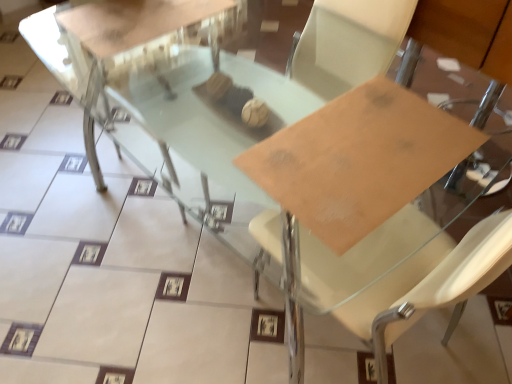
Question: Is matte cardboard at center at the back of clear glass table at center?

Choices:
 (A) no
 (B) yes

Answer: (A)

Question: Considering the relative sizes of clear glass table at center and matte cardboard at center in the image provided, is clear glass table at center bigger than matte cardboard at center?

Choices:
 (A) no
 (B) yes

Answer: (B)

Question: Is clear glass table at center further to camera compared to matte cardboard at center?

Choices:
 (A) no
 (B) yes

Answer: (B)

Question: Is clear glass table at center not near matte cardboard at center?

Choices:
 (A) yes
 (B) no

Answer: (A)

Question: Is clear glass table at center thinner than matte cardboard at center?

Choices:
 (A) no
 (B) yes

Answer: (A)

Question: From a real-world perspective, is clear glass table at center under matte cardboard at center?

Choices:
 (A) no
 (B) yes

Answer: (B)

Question: Is matte cardboard at center further to camera compared to clear glass table at center?

Choices:
 (A) no
 (B) yes

Answer: (A)

Question: Can you confirm if matte cardboard at center is thinner than clear glass table at center?

Choices:
 (A) no
 (B) yes

Answer: (B)

Question: Is matte cardboard at center taller than clear glass table at center?

Choices:
 (A) yes
 (B) no

Answer: (B)

Question: Can you confirm if matte cardboard at center is smaller than clear glass table at center?

Choices:
 (A) yes
 (B) no

Answer: (A)

Question: From the image's perspective, would you say matte cardboard at center is positioned over clear glass table at center?

Choices:
 (A) yes
 (B) no

Answer: (B)

Question: From a real-world perspective, is matte cardboard at center physically below clear glass table at center?

Choices:
 (A) yes
 (B) no

Answer: (B)

Question: Is matte cardboard at center in front of or behind clear glass table at center in the image?

Choices:
 (A) front
 (B) behind

Answer: (A)